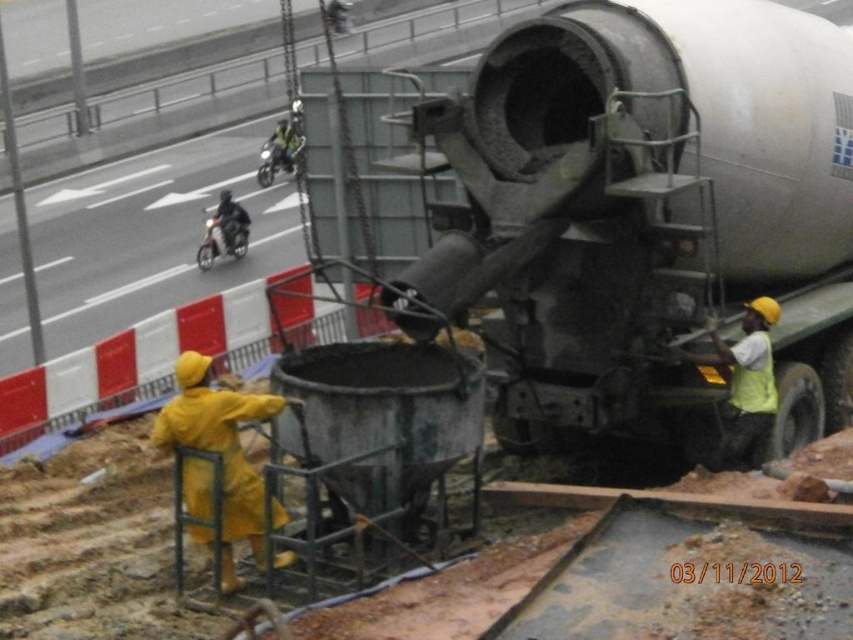
You are a delivery person who needs to park your 1.8 meters wide truck between the yellow rubber raincoat at lower left and the green matte motorcycle at upper center. Can you fit your truck there?

The yellow rubber raincoat at lower left is much taller than the green matte motorcycle at upper center, but the description does not provide information about the distance between them. Without knowing the space between the two objects, it is impossible to determine if the truck can fit.

You are a delivery person who needs to park your 1.5 meter wide van between the yellow rubber raincoat at lower left and the green matte motorcycle at upper center. Can your van fit in the space between them?

The yellow rubber raincoat at lower left is narrower than the green matte motorcycle at upper center. However, the exact distance between them isn

You are a safety inspector at the construction site. You need to ensure that the shiny black motorcycle at upper left is visible to the workers near the matte gray tank at right. Given their heights, will the motorcycle be visible over the tank?

The matte gray tank at right is taller than the shiny black motorcycle at upper left. Since the tank is taller, it may block the view of the motorcycle from the workers near it, making the motorcycle less visible.